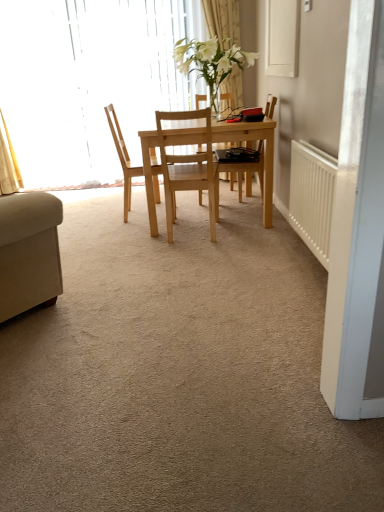
Question: Can you confirm if natural wood chair at center, the second chair when ordered from right to left, is wider than white sheer curtain at upper center?

Choices:
 (A) yes
 (B) no

Answer: (A)

Question: Is natural wood chair at center, the second chair when ordered from right to left, further to camera compared to white sheer curtain at upper center?

Choices:
 (A) no
 (B) yes

Answer: (A)

Question: Considering the relative sizes of natural wood chair at center, the second chair when ordered from right to left, and white sheer curtain at upper center in the image provided, is natural wood chair at center, the second chair when ordered from right to left, taller than white sheer curtain at upper center?

Choices:
 (A) no
 (B) yes

Answer: (A)

Question: Is natural wood chair at center, the 1th chair when ordered from left to right, not near white sheer curtain at upper center?

Choices:
 (A) no
 (B) yes

Answer: (B)

Question: Considering the relative sizes of natural wood chair at center, the 1th chair when ordered from left to right, and white sheer curtain at upper center in the image provided, is natural wood chair at center, the 1th chair when ordered from left to right, bigger than white sheer curtain at upper center?

Choices:
 (A) yes
 (B) no

Answer: (A)

Question: In terms of size, does light wood table at center appear bigger or smaller than translucent glass window at upper left?

Choices:
 (A) big
 (B) small

Answer: (A)

Question: From the image's perspective, relative to translucent glass window at upper left, is light wood table at center above or below?

Choices:
 (A) below
 (B) above

Answer: (A)

Question: From a real-world perspective, is light wood table at center positioned above or below translucent glass window at upper left?

Choices:
 (A) below
 (B) above

Answer: (A)

Question: Considering the positions of point (150, 181) and point (6, 20), is point (150, 181) closer or farther from the camera than point (6, 20)?

Choices:
 (A) farther
 (B) closer

Answer: (B)

Question: In terms of size, does white sheer curtain at upper center appear bigger or smaller than white plastic radiator at right?

Choices:
 (A) big
 (B) small

Answer: (A)

Question: In the image, is white sheer curtain at upper center on the left side or the right side of white plastic radiator at right?

Choices:
 (A) left
 (B) right

Answer: (A)

Question: Is white sheer curtain at upper center inside or outside of white plastic radiator at right?

Choices:
 (A) outside
 (B) inside

Answer: (A)

Question: In terms of width, does white sheer curtain at upper center look wider or thinner when compared to white plastic radiator at right?

Choices:
 (A) thin
 (B) wide

Answer: (B)

Question: In terms of height, does translucent glass window at upper left look taller or shorter compared to natural wood chair at center, arranged as the 2th chair when viewed from the left?

Choices:
 (A) tall
 (B) short

Answer: (A)

Question: From a real-world perspective, is translucent glass window at upper left physically located above or below natural wood chair at center, positioned as the 1th chair in right-to-left order?

Choices:
 (A) above
 (B) below

Answer: (A)